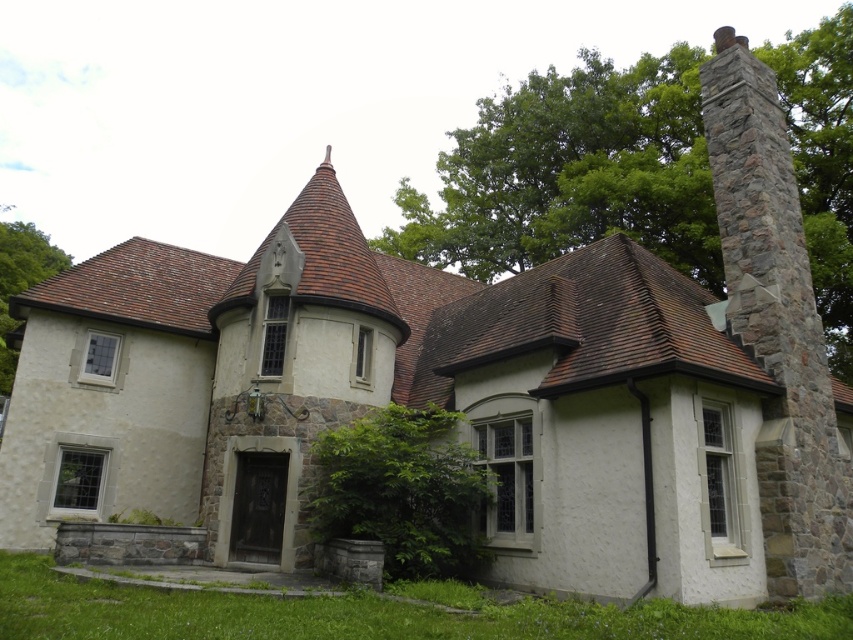
Can you confirm if green leafy tree at lower center is positioned to the right of green leafy tree at upper left?

Yes, green leafy tree at lower center is to the right of green leafy tree at upper left.

Between point (467, 493) and point (12, 225), which one is positioned in front?

Point (467, 493)

This screenshot has width=853, height=640. I want to click on green leafy tree at lower center, so click(x=402, y=492).

Between point (670, 196) and point (10, 374), which one is positioned behind?

The point (10, 374) is behind.

Is point (666, 172) more distant than point (3, 326)?

No, (666, 172) is in front of (3, 326).

What do you see at coordinates (572, 172) in the screenshot? I see `green leafy tree at upper right` at bounding box center [572, 172].

I want to click on green leafy tree at upper right, so click(x=572, y=172).

Which is in front, point (695, 237) or point (415, 444)?

Positioned in front is point (415, 444).

Describe the element at coordinates (572, 172) in the screenshot. Image resolution: width=853 pixels, height=640 pixels. I see `green leafy tree at upper right` at that location.

This screenshot has width=853, height=640. In order to click on green leafy tree at upper right in this screenshot , I will do `click(572, 172)`.